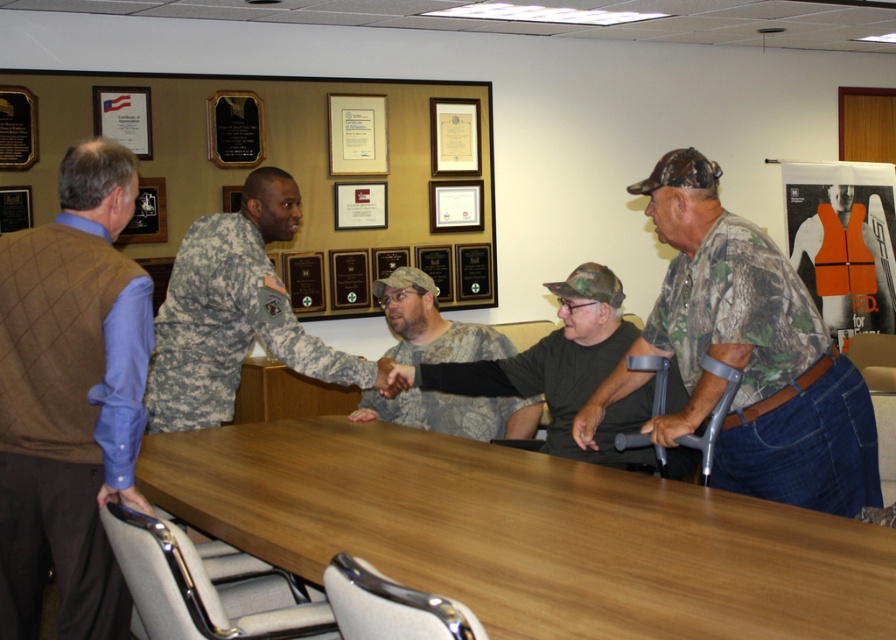
You are attending a formal meeting and notice two individuals at the center of the table shaking hands. Which one is positioned to the left of the other? The camouflage fabric uniform at center and the camouflage fabric shirt at center are both involved in the handshake.

The camouflage fabric uniform at center is to the left of the camouflage fabric shirt at center.

Consider the image. You are organizing a photo shoot and need to ensure that the two camouflage items in the scene are positioned appropriately. Given that the camouflage fabric shirt at center and the camouflage uniform at center must be placed side by side on a rack, which item should be placed on the left to ensure proper alignment without overlapping?

The camouflage fabric shirt at center should be placed on the left since its width is larger than the camouflage uniform at center, allowing it to occupy more space on the rack and prevent overlapping.